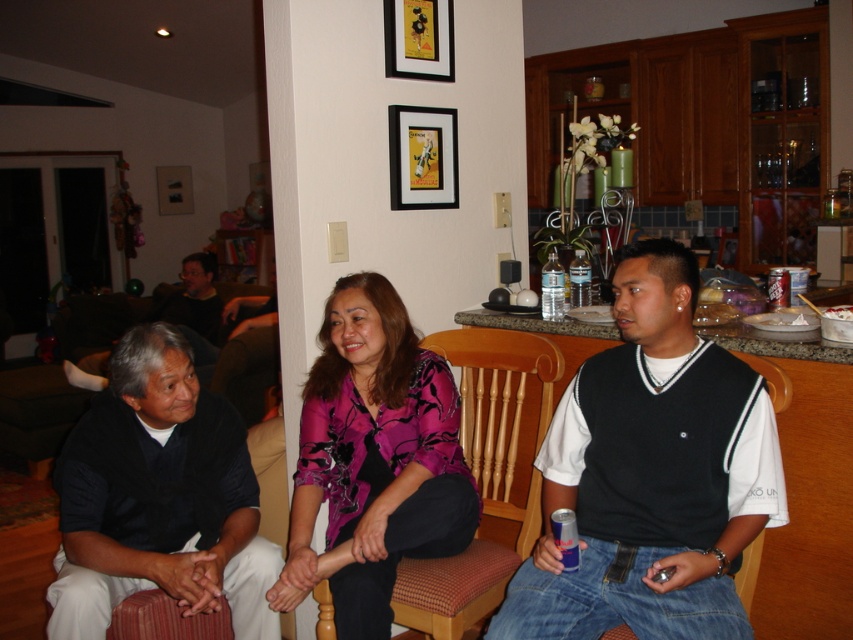
Question: Is black matte shirt at lower left positioned at the back of matte black picture frame at upper center?

Choices:
 (A) no
 (B) yes

Answer: (A)

Question: Which object appears closest to the camera in this image?

Choices:
 (A) black knit vest at center
 (B) black matte shirt at lower left
 (C) wooden chair at center

Answer: (A)

Question: Can you confirm if matte black picture frame at upper center is positioned to the right of wooden chair at center?

Choices:
 (A) no
 (B) yes

Answer: (A)

Question: Where is matte black picture frame at upper center located in relation to wooden chair at center in the image?

Choices:
 (A) right
 (B) left

Answer: (B)

Question: Which point appears closest to the camera in this image?

Choices:
 (A) (148, 406)
 (B) (785, 378)
 (C) (438, 38)
 (D) (403, 464)

Answer: (B)

Question: Which of the following is the farthest from the observer?

Choices:
 (A) (744, 557)
 (B) (96, 595)
 (C) (387, 136)
 (D) (438, 44)

Answer: (D)